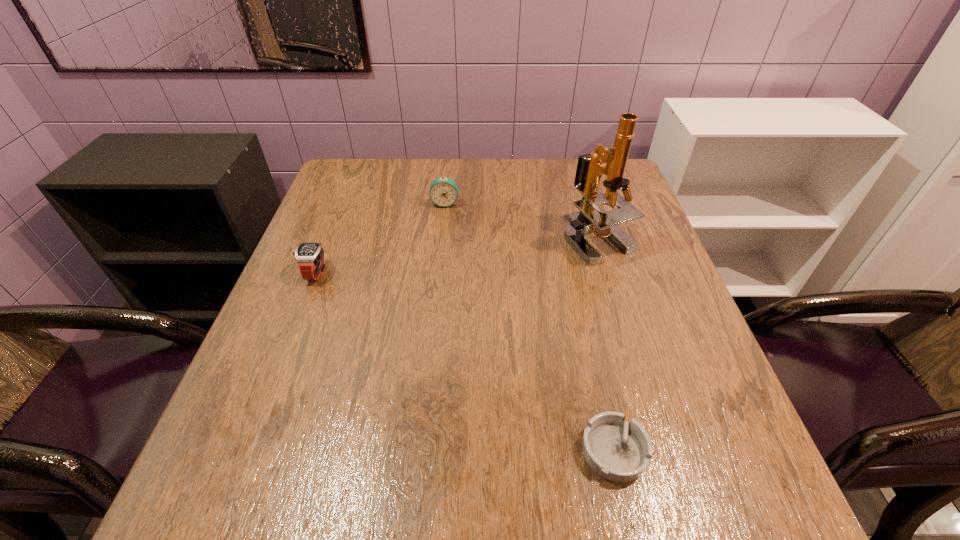
At what (x,y) coordinates should I click in order to perform the action: click on free space between the third tallest object and the nearest object. Please return your answer as a coordinate pair (x, y). This screenshot has height=540, width=960. Looking at the image, I should click on (464, 361).

Identify the location of vacant area between the third object from right to left and the microscope. (521, 220).

What are the coordinates of `free point between the alarm clock and the leftmost object` in the screenshot? It's located at (380, 238).

The image size is (960, 540). Find the location of `free point between the nearest object and the watch`. free point between the nearest object and the watch is located at coordinates (464, 361).

Where is `free area in between the third tallest object and the microscope`? The width and height of the screenshot is (960, 540). free area in between the third tallest object and the microscope is located at coordinates (456, 255).

Find the location of `free space between the leftmost object and the nearest object`. free space between the leftmost object and the nearest object is located at coordinates (464, 361).

You are a GUI agent. You are given a task and a screenshot of the screen. Output one action in this format:
    pyautogui.click(x=<x>, y=<y>)
    Task: Click on the free space between the microscope and the third object from right to left
    Image resolution: width=960 pixels, height=540 pixels.
    Given the screenshot: What is the action you would take?
    pyautogui.click(x=521, y=220)

Locate an element on the screen. vacant area that lies between the second shortest object and the alarm clock is located at coordinates pyautogui.click(x=380, y=238).

Where is `vacant space in between the second object from left to right and the tallest object`? The height and width of the screenshot is (540, 960). vacant space in between the second object from left to right and the tallest object is located at coordinates (521, 220).

Locate an element on the screen. vacant area that lies between the second object from left to right and the watch is located at coordinates (380, 238).